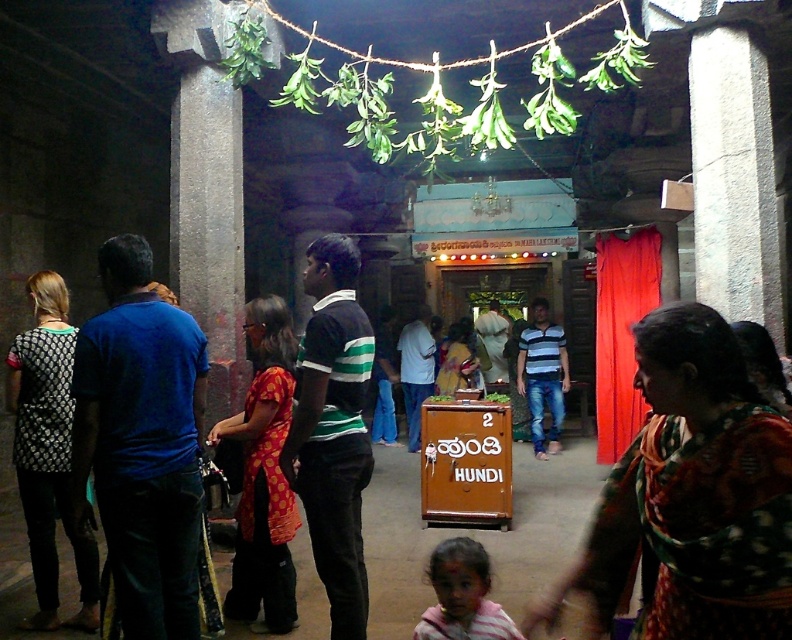
Question: Can you confirm if printed silk saree at center is positioned below patterned fabric dress at left?

Choices:
 (A) no
 (B) yes

Answer: (A)

Question: Which point appears farthest from the camera in this image?

Choices:
 (A) (642, 452)
 (B) (290, 612)
 (C) (488, 582)

Answer: (B)

Question: Which object appears farthest from the camera in this image?

Choices:
 (A) patterned fabric dress at left
 (B) striped cotton hoodie at lower center
 (C) printed silk saree at center

Answer: (A)

Question: Does polka dot fabric dress at center appear on the left side of striped cotton hoodie at lower center?

Choices:
 (A) yes
 (B) no

Answer: (A)

Question: Does patterned fabric dress at left come behind polka dot fabric dress at center?

Choices:
 (A) no
 (B) yes

Answer: (A)

Question: Which point is farther to the camera?

Choices:
 (A) polka dot fabric dress at center
 (B) printed silk saree at center

Answer: (A)